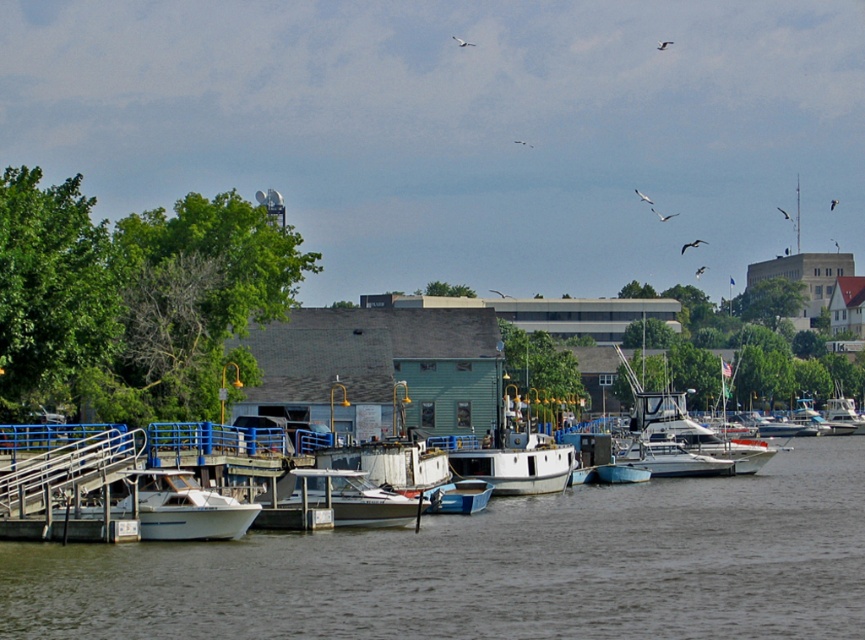
Question: Considering the relative positions of white glossy boat at lower left and metallic blue boat at center in the image provided, where is white glossy boat at lower left located with respect to metallic blue boat at center?

Choices:
 (A) left
 (B) right

Answer: (A)

Question: Which object is positioned farthest from the white matte water at center?

Choices:
 (A) white glossy boat at lower left
 (B) white glossy boat at center

Answer: (B)

Question: Which point appears closest to the camera in this image?

Choices:
 (A) (143, 529)
 (B) (456, 490)

Answer: (A)

Question: Is white glossy boat at lower left thinner than metallic blue boat at center?

Choices:
 (A) yes
 (B) no

Answer: (B)

Question: Based on their relative distances, which object is nearer to the white glossy boat at lower left?

Choices:
 (A) white glossy boat at center
 (B) metallic blue boat at center
 (C) white matte water at center

Answer: (A)

Question: Does white matte water at center have a larger size compared to white glossy boat at center?

Choices:
 (A) no
 (B) yes

Answer: (B)